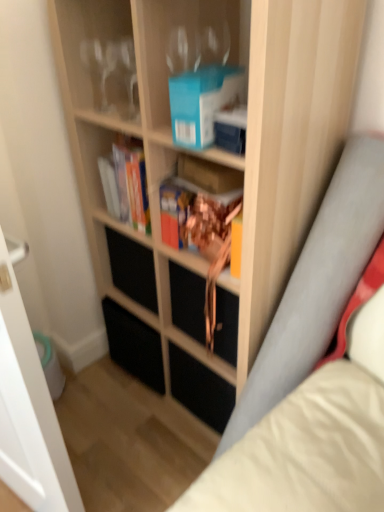
This screenshot has width=384, height=512. What do you see at coordinates (202, 102) in the screenshot?
I see `blue matte paperback book at upper center` at bounding box center [202, 102].

What do you see at coordinates (126, 183) in the screenshot? I see `hardcover book at center, placed as the 1th book when sorted from left to right` at bounding box center [126, 183].

What is the approximate height of transparent glass door at left?

It is 4.22 feet.

Where is `transparent glass door at left`? This screenshot has height=512, width=384. transparent glass door at left is located at coordinates (29, 411).

This screenshot has width=384, height=512. In order to click on hardcover book at center, placed as the first book when sorted from right to left in this screenshot , I will do pyautogui.click(x=174, y=214).

In order to click on clear glass wine glasses at upper left in this screenshot , I will do `click(97, 54)`.

The height and width of the screenshot is (512, 384). I want to click on blue matte paperback book at upper center, so click(202, 102).

Looking at this image, from a real-world perspective, who is located lower, black matte drawer at center or blue matte paperback book at upper center?

black matte drawer at center, from a real-world perspective.

Is point (139, 353) more distant than point (209, 75)?

Yes.

Between black matte drawer at center and blue matte paperback book at upper center, which one has larger size?

Bigger between the two is black matte drawer at center.

Between point (191, 90) and point (123, 199), which one is positioned in front?

The point (191, 90) is closer to the camera.

Is blue matte paperback book at upper center positioned behind hardcover book at center, the second book from the right?

No, blue matte paperback book at upper center is in front of hardcover book at center, the second book from the right.

From a real-world perspective, between blue matte paperback book at upper center and hardcover book at center, which is the first book from back to front, who is vertically higher?

blue matte paperback book at upper center, from a real-world perspective.

Considering the relative sizes of blue matte paperback book at upper center and hardcover book at center, the second book from the right, in the image provided, is blue matte paperback book at upper center wider than hardcover book at center, the second book from the right,?

Yes.

Is blue matte paperback book at upper center far from hardcover book at center, the 2th book when ordered from left to right?

blue matte paperback book at upper center is near hardcover book at center, the 2th book when ordered from left to right, not far away.

Is blue matte paperback book at upper center oriented away from hardcover book at center, placed as the first book when sorted from right to left?

blue matte paperback book at upper center does not have its back to hardcover book at center, placed as the first book when sorted from right to left.

Is blue matte paperback book at upper center inside or outside of hardcover book at center, which appears as the 2th book when viewed from the back?

blue matte paperback book at upper center is not inside hardcover book at center, which appears as the 2th book when viewed from the back, it's outside.

Does blue matte paperback book at upper center have a greater height compared to hardcover book at center, the 2th book when ordered from left to right?

No.

Considering the relative positions of hardcover book at center, which is the first book from back to front, and transparent glass door at left in the image provided, is hardcover book at center, which is the first book from back to front, in front of transparent glass door at left?

No, the depth of hardcover book at center, which is the first book from back to front, is greater than that of transparent glass door at left.

At what (x,y) coordinates should I click in order to perform the action: click on glass door on the left of hardcover book at center, placed as the 1th book when sorted from left to right. Please return your answer as a coordinate pair (x, y). The image size is (384, 512). Looking at the image, I should click on (29, 411).

Which of these two, hardcover book at center, placed as the 1th book when sorted from left to right, or transparent glass door at left, is wider?

With larger width is transparent glass door at left.

Considering the sizes of hardcover book at center, placed as the 1th book when sorted from left to right, and transparent glass door at left in the image, is hardcover book at center, placed as the 1th book when sorted from left to right, taller or shorter than transparent glass door at left?

Clearly, hardcover book at center, placed as the 1th book when sorted from left to right, is shorter compared to transparent glass door at left.

Is hardcover book at center, which is the first book from back to front, smaller than black matte drawer at center?

Indeed, hardcover book at center, which is the first book from back to front, has a smaller size compared to black matte drawer at center.

The width and height of the screenshot is (384, 512). What are the coordinates of `drawer behind the hardcover book at center, which appears as the second book when viewed from the front` in the screenshot? It's located at (134, 345).

Does hardcover book at center, which is the first book from back to front, lie behind black matte drawer at center?

No, it is not.

How many degrees apart are the facing directions of clear glass wine glasses at upper left and black matte drawer at center?

0.001 degrees separate the facing orientations of clear glass wine glasses at upper left and black matte drawer at center.

Is point (79, 5) less distant than point (148, 331)?

Yes, point (79, 5) is in front of point (148, 331).

Is clear glass wine glasses at upper left bigger or smaller than black matte drawer at center?

Considering their sizes, clear glass wine glasses at upper left takes up less space than black matte drawer at center.

Does clear glass wine glasses at upper left have a lesser height compared to black matte drawer at center?

Indeed, clear glass wine glasses at upper left has a lesser height compared to black matte drawer at center.

Is black matte drawer at center further to the viewer compared to transparent glass door at left?

That is True.

Is black matte drawer at center positioned with its back to transparent glass door at left?

No, black matte drawer at center is not facing away from transparent glass door at left.

Is black matte drawer at center inside or outside of transparent glass door at left?

black matte drawer at center exists outside the volume of transparent glass door at left.

From a real-world perspective, relative to transparent glass door at left, is black matte drawer at center vertically above or below?

black matte drawer at center is below transparent glass door at left.

At what (x,y) coordinates should I click in order to perform the action: click on paperback book above the black matte drawer at center (from the image's perspective). Please return your answer as a coordinate pair (x, y). Image resolution: width=384 pixels, height=512 pixels. Looking at the image, I should click on (202, 102).

The width and height of the screenshot is (384, 512). I want to click on paperback book that appears on the right of hardcover book at center, the second book from the right, so click(202, 102).

When comparing their distances from transparent glass door at left, does blue matte paperback book at upper center or wooden bookcase at center seem further?

Based on the image, blue matte paperback book at upper center appears to be further to transparent glass door at left.

From the image, which object appears to be farther from wooden bookcase at center, hardcover book at center, which is the first book from back to front, or blue matte paperback book at upper center?

Among the two, blue matte paperback book at upper center is located further to wooden bookcase at center.

When comparing their distances from transparent glass door at left, does clear glass wine glasses at upper left or hardcover book at center, which appears as the second book when viewed from the front, seem further?

clear glass wine glasses at upper left lies further to transparent glass door at left than the other object.

From the image, which object appears to be nearer to transparent glass door at left, hardcover book at center, placed as the 1th book when sorted from left to right, or hardcover book at center, which appears as the 2th book when viewed from the back?

hardcover book at center, placed as the 1th book when sorted from left to right.

Based on their spatial positions, is blue matte paperback book at upper center or black matte drawer at center closer to hardcover book at center, which is counted as the first book, starting from the front?

The object closer to hardcover book at center, which is counted as the first book, starting from the front, is blue matte paperback book at upper center.

Estimate the real-world distances between objects in this image. Which object is closer to hardcover book at center, placed as the 1th book when sorted from left to right, hardcover book at center, which appears as the 2th book when viewed from the back, or wooden bookcase at center?

hardcover book at center, which appears as the 2th book when viewed from the back, is positioned closer to the anchor hardcover book at center, placed as the 1th book when sorted from left to right.

Estimate the real-world distances between objects in this image. Which object is closer to hardcover book at center, placed as the first book when sorted from right to left, wooden bookcase at center or hardcover book at center, which is the first book from back to front?

The object closer to hardcover book at center, placed as the first book when sorted from right to left, is hardcover book at center, which is the first book from back to front.

Estimate the real-world distances between objects in this image. Which object is further from black matte drawer at center, wooden bookcase at center or blue matte paperback book at upper center?

The object further to black matte drawer at center is blue matte paperback book at upper center.

You are a GUI agent. You are given a task and a screenshot of the screen. Output one action in this format:
    pyautogui.click(x=<x>, y=<y>)
    Task: Click on the paperback book located between wooden bookcase at center and hardcover book at center, which is counted as the first book, starting from the front, in the depth direction
    Image resolution: width=384 pixels, height=512 pixels.
    Given the screenshot: What is the action you would take?
    pyautogui.click(x=202, y=102)

Locate an element on the screen. shelf between wooden bookcase at center and hardcover book at center, which appears as the second book when viewed from the front, from front to back is located at coordinates (97, 54).

Identify the location of paperback book between clear glass wine glasses at upper left and hardcover book at center, which is counted as the first book, starting from the front, in the vertical direction. The image size is (384, 512). (202, 102).

Image resolution: width=384 pixels, height=512 pixels. I want to click on paperback book between transparent glass door at left and hardcover book at center, which appears as the second book when viewed from the front, in the front-back direction, so click(x=202, y=102).